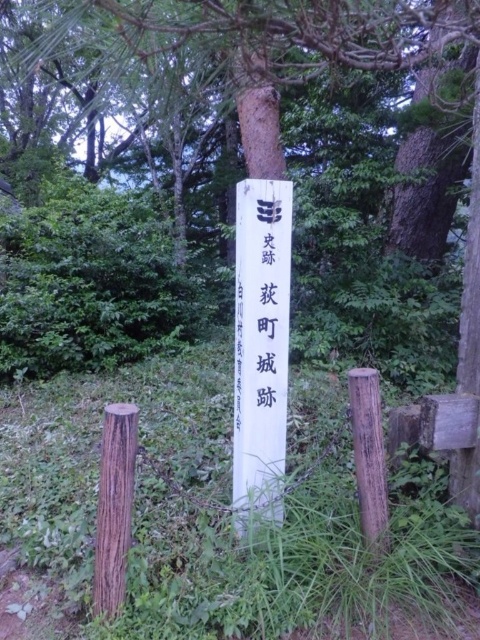
Question: Is brown wooden post at center below brown rough wooden post at center?

Choices:
 (A) no
 (B) yes

Answer: (B)

Question: Which point appears closest to the camera in this image?

Choices:
 (A) (103, 486)
 (B) (320, 288)

Answer: (A)

Question: Does white wood post at center appear over brown rough wooden post at center?

Choices:
 (A) no
 (B) yes

Answer: (B)

Question: Which object is farther from the camera taking this photo?

Choices:
 (A) brown rough wooden post at lower left
 (B) brown rough wooden post at center
 (C) white wood post at center
 (D) white paper sign at center

Answer: (C)

Question: Which point appears closest to the camera in this image?

Choices:
 (A) (369, 531)
 (B) (284, 218)
 (C) (91, 259)

Answer: (A)

Question: Is white wood post at center closer to camera compared to white paper sign at center?

Choices:
 (A) no
 (B) yes

Answer: (A)